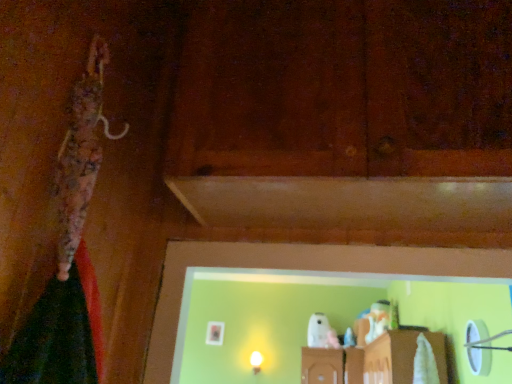
Question: Considering the relative sizes of brown matte wood at center and matte white bulb at center in the image provided, is brown matte wood at center taller than matte white bulb at center?

Choices:
 (A) no
 (B) yes

Answer: (B)

Question: Is brown matte wood at center positioned far away from matte white bulb at center?

Choices:
 (A) yes
 (B) no

Answer: (A)

Question: Is brown matte wood at center positioned beyond the bounds of matte white bulb at center?

Choices:
 (A) no
 (B) yes

Answer: (B)

Question: Does brown matte wood at center appear on the right side of matte white bulb at center?

Choices:
 (A) no
 (B) yes

Answer: (B)

Question: Considering the relative positions of brown matte wood at center and matte white bulb at center in the image provided, is brown matte wood at center to the left of matte white bulb at center from the viewer's perspective?

Choices:
 (A) no
 (B) yes

Answer: (A)

Question: From a real-world perspective, does brown matte wood at center sit lower than matte white bulb at center?

Choices:
 (A) yes
 (B) no

Answer: (B)

Question: Is matte white bulb at center beside brown matte wood at center?

Choices:
 (A) yes
 (B) no

Answer: (B)

Question: Is matte white bulb at center at the left side of brown matte wood at center?

Choices:
 (A) yes
 (B) no

Answer: (A)

Question: Can you confirm if matte white bulb at center is thinner than brown matte wood at center?

Choices:
 (A) yes
 (B) no

Answer: (A)

Question: Can you confirm if matte white bulb at center is taller than brown matte wood at center?

Choices:
 (A) yes
 (B) no

Answer: (B)

Question: Considering the relative positions of matte white bulb at center and brown matte wood at center in the image provided, is matte white bulb at center to the right of brown matte wood at center from the viewer's perspective?

Choices:
 (A) no
 (B) yes

Answer: (A)

Question: Is matte white bulb at center far from brown matte wood at center?

Choices:
 (A) yes
 (B) no

Answer: (A)

Question: Is matte white bulb at center in front of or behind brown matte wood at center in the image?

Choices:
 (A) front
 (B) behind

Answer: (B)